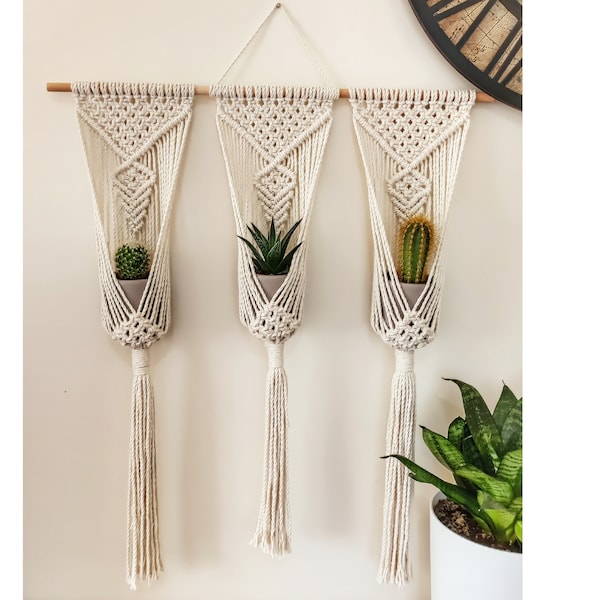
Image resolution: width=600 pixels, height=600 pixels. I want to click on white wall in background, so coord(331,425).